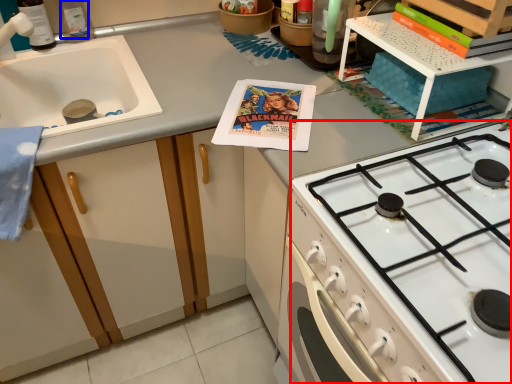
Question: Which object is further to the camera taking this photo, gas stove (highlighted by a red box) or bottle (highlighted by a blue box)?

Choices:
 (A) gas stove
 (B) bottle

Answer: (B)